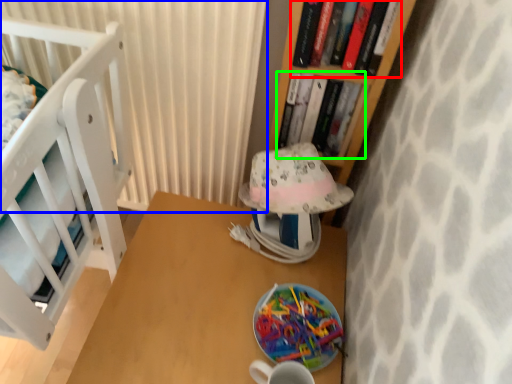
Question: Which object is the farthest from book (highlighted by a red box)? Choose among these: curtain (highlighted by a blue box) or book (highlighted by a green box).

Choices:
 (A) curtain
 (B) book

Answer: (A)